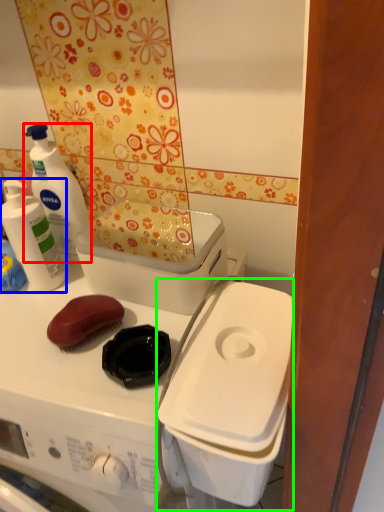
Question: Which is nearer to the cleaning product (highlighted by a red box)? cleaning product (highlighted by a blue box) or appliance (highlighted by a green box).

Choices:
 (A) cleaning product
 (B) appliance

Answer: (A)